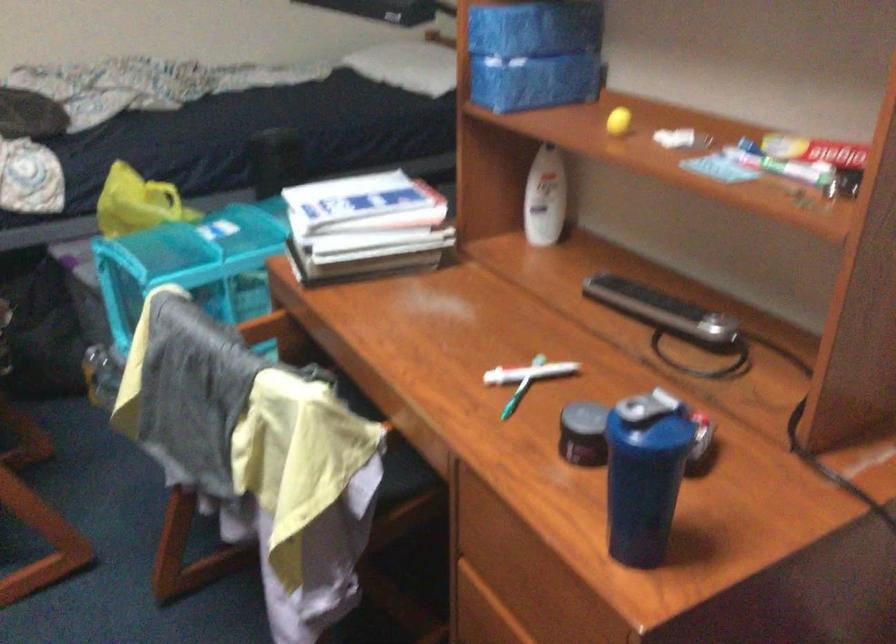
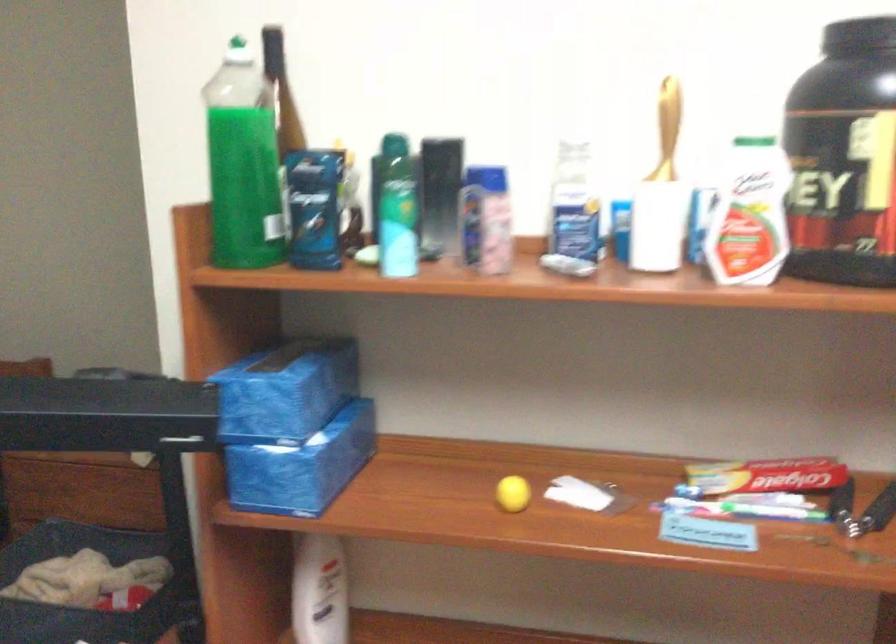
Where in the second image is the point corresponding to pixel 776 169 from the first image?

(743, 509)